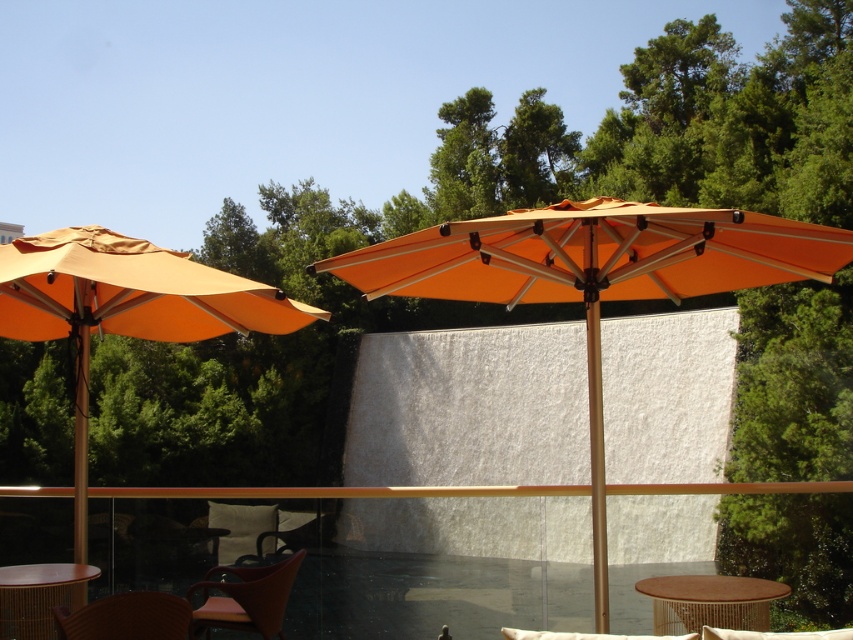
You are planning to install a new light fixture on the orange fabric umbrella at left and need to know its height relative to the brown woven chair at lower left. Which object is taller?

The brown woven chair at lower left is taller than the orange fabric umbrella at left.

You are standing at the camera position looking at the outdoor patio. There are two points marked in the scene, point 1 at coordinates point (99, 262) and point 2 at coordinates point (212, 600). Which point is closer to you?

Point (99, 262) is closer to the camera than point (212, 600).

You are standing at the entrance of the patio and want to move towards the orange fabric umbrella at left. Which direction should you head in to reach it?

The orange fabric umbrella at left is located at point 0.481 on the x and 0.147 on the y coordinate, so you should head towards the left side of the patio to reach it.